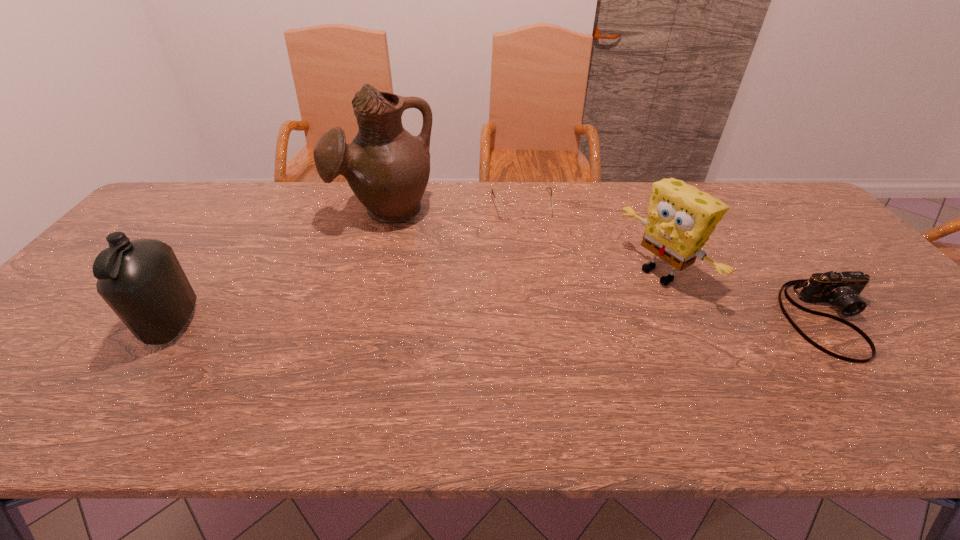
Locate an element on the screen. the leftmost object is located at coordinates (142, 281).

Find the location of a particular element. This screenshot has height=540, width=960. the fourth tallest object is located at coordinates (842, 289).

Where is `camera`? camera is located at coordinates (842, 289).

Where is `the third object from left to right`? The height and width of the screenshot is (540, 960). the third object from left to right is located at coordinates (539, 210).

The width and height of the screenshot is (960, 540). I want to click on spectacles, so click(539, 210).

What are the coordinates of `pitcher` in the screenshot? It's located at (387, 168).

Find the location of a particular element. The image size is (960, 540). the fourth object from right to left is located at coordinates (387, 168).

Image resolution: width=960 pixels, height=540 pixels. I want to click on the second object from right to left, so click(x=680, y=220).

Find the location of `vacant space located on the right of the leftmost object`. vacant space located on the right of the leftmost object is located at coordinates (309, 324).

Locate an element on the screen. vacant space located through the lenses of the spectacles is located at coordinates (544, 305).